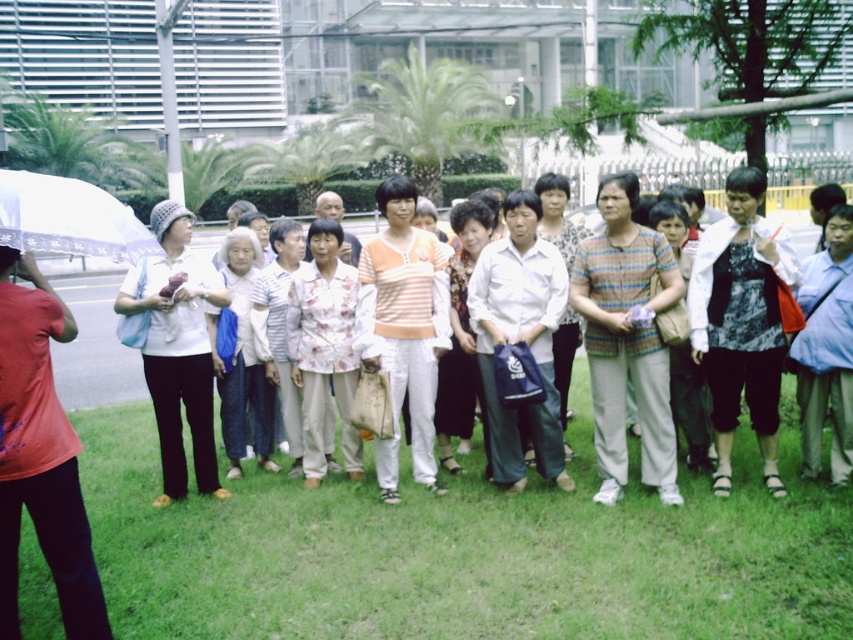
Which is more to the left, matte red t-shirt at left or white matte shirt at center?

From the viewer's perspective, white matte shirt at center appears more on the left side.

Is point (25, 378) more distant than point (157, 230)?

No, (25, 378) is closer to viewer.

Is point (73, 320) positioned after point (140, 310)?

No, it is not.

I want to click on matte red t-shirt at left, so click(x=39, y=456).

Can you confirm if green grass at lower center is thinner than light blue shirt at center?

No.

I want to click on green grass at lower center, so click(x=465, y=550).

Measure the distance from white matte shirt at center to light blue shirt at center.

white matte shirt at center and light blue shirt at center are 4.01 meters apart from each other.

The image size is (853, 640). What do you see at coordinates (177, 348) in the screenshot?
I see `white matte shirt at center` at bounding box center [177, 348].

In the scene shown: Who is more forward, (170, 486) or (810, 472)?

Positioned in front is point (810, 472).

Locate an element on the screen. This screenshot has height=640, width=853. white matte shirt at center is located at coordinates (177, 348).